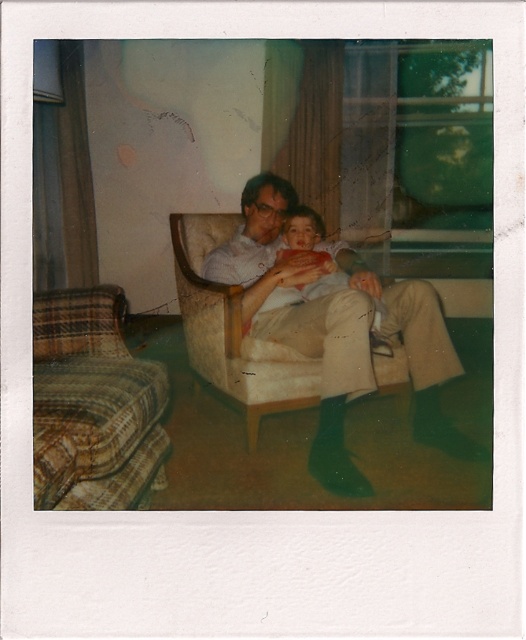
You are a photographer trying to decide where to place a small potted plant in this scene. The plant needs to fit between the light brown fabric chair at center and the smooth red shirt at center. Given their sizes, will there be enough space for the plant?

The light brown fabric chair at center is bigger than the smooth red shirt at center, so there should be sufficient space between them to place the small potted plant.

In the Polaroid photograph, there is a light brown fabric chair at center and a smooth red shirt at center. Which object is positioned to the right side of the other?

The light brown fabric chair at center is to the right of the smooth red shirt at center.